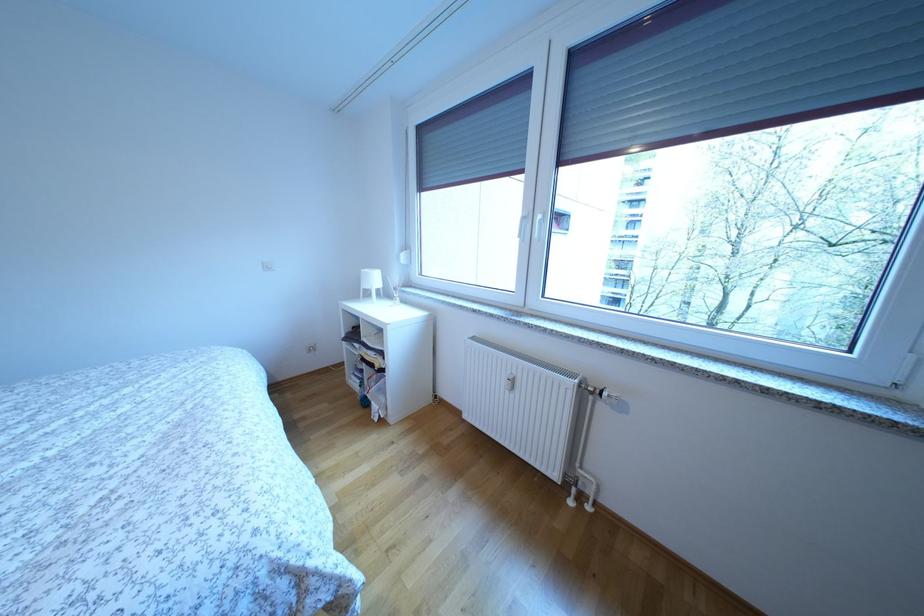
The width and height of the screenshot is (924, 616). I want to click on radiator thermostat knob, so click(x=509, y=382).